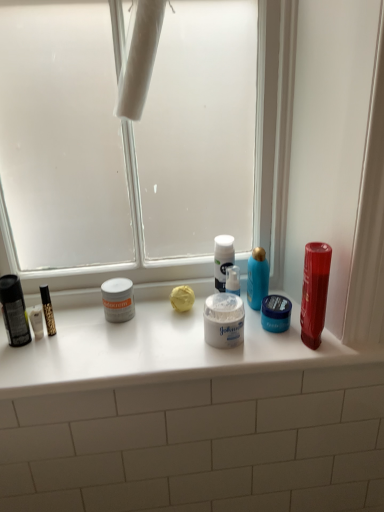
This screenshot has height=512, width=384. What are the coordinates of `free space to the left of white matte jar at center` in the screenshot? It's located at [163, 342].